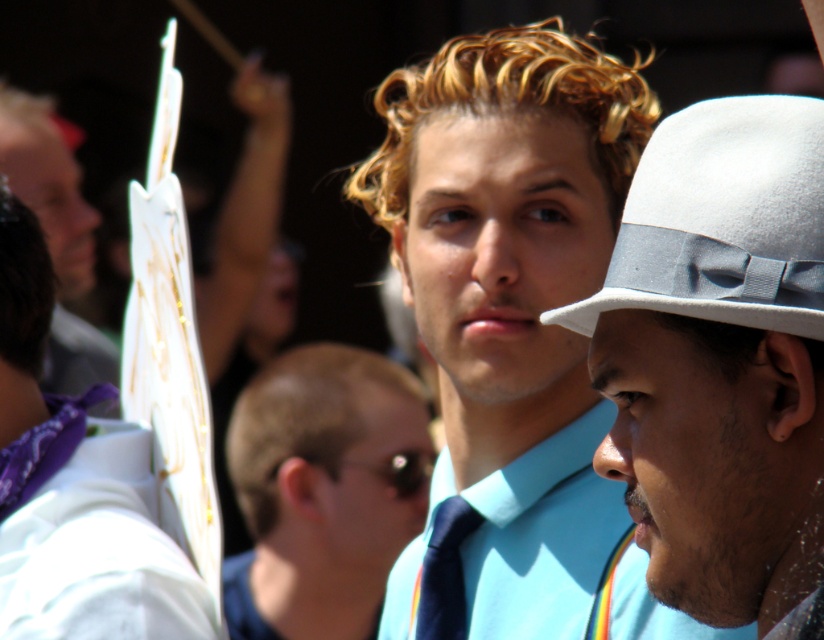
This screenshot has height=640, width=824. In order to click on matte blue shirt at center in this screenshot , I will do `click(516, 321)`.

Is point (542, 99) positioned behind point (62, 616)?

Yes.

Where is `matte blue shirt at center`? Image resolution: width=824 pixels, height=640 pixels. matte blue shirt at center is located at coordinates (516, 321).

From the picture: Between matte white sign at left and dark blue silk tie at center, which one is positioned lower?

dark blue silk tie at center is below.

At what (x,y) coordinates should I click in order to perform the action: click on matte white sign at left. Please return your answer as a coordinate pair (x, y). The width and height of the screenshot is (824, 640). Looking at the image, I should click on (48, 186).

Where is `matte white sign at left`? matte white sign at left is located at coordinates (48, 186).

Where is `matte white sign at left`? The width and height of the screenshot is (824, 640). matte white sign at left is located at coordinates (48, 186).

Does matte blue shirt at center appear on the left side of white felt fedora at upper center?

Yes, matte blue shirt at center is to the left of white felt fedora at upper center.

From the picture: Who is more distant from viewer, (x=602, y=186) or (x=698, y=134)?

Point (x=602, y=186)

Locate an element on the screen. The image size is (824, 640). matte blue shirt at center is located at coordinates (516, 321).